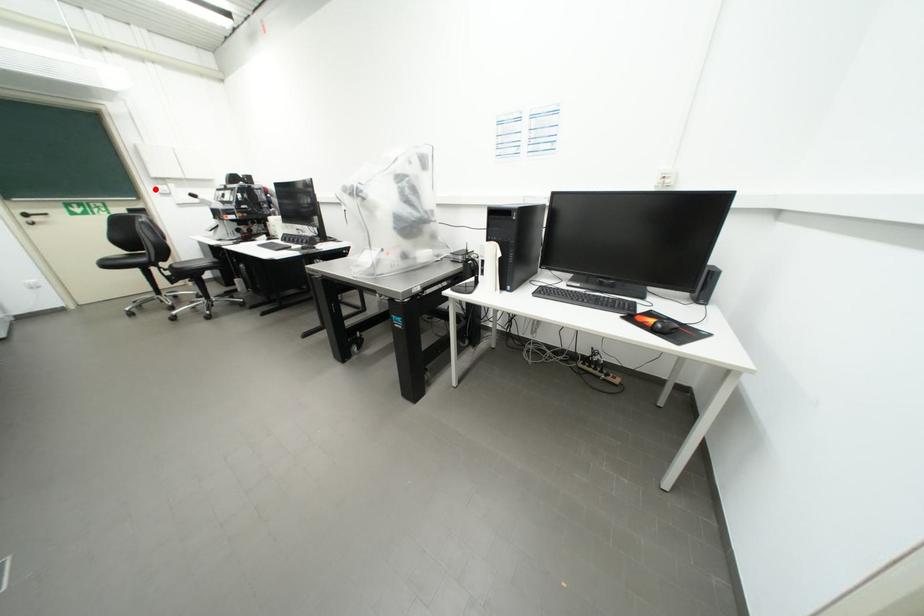
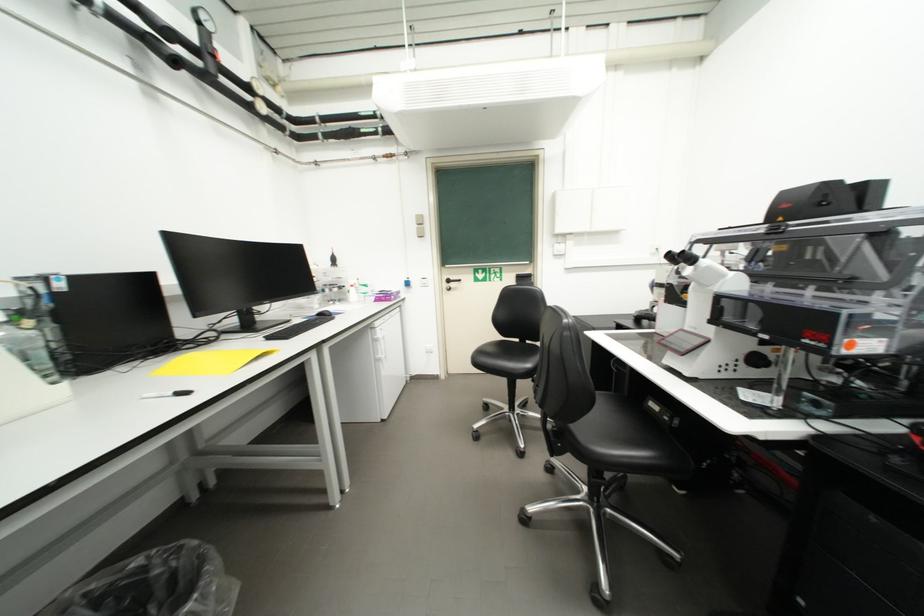
Locate, in the second image, the point that corresponds to the highlighted location in the first image.

(553, 249)